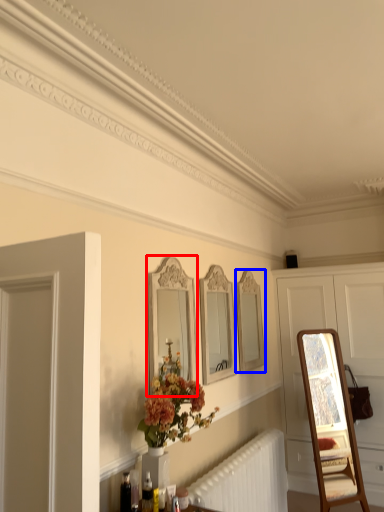
Question: Which object appears farthest to the camera in this image, mirror (highlighted by a red box) or mirror (highlighted by a blue box)?

Choices:
 (A) mirror
 (B) mirror

Answer: (B)